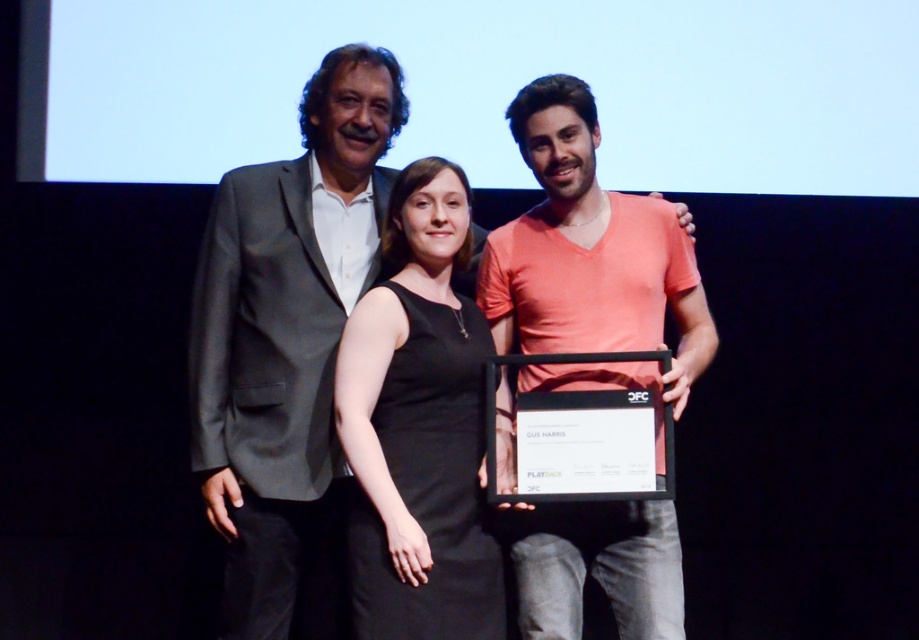
You are standing in front of the stage and want to know which of the two points, point [373,234] or point [406,292], is closer to you. Which one is closer?

Point [373,234] is closer to you because it is further to the camera than point [406,292].